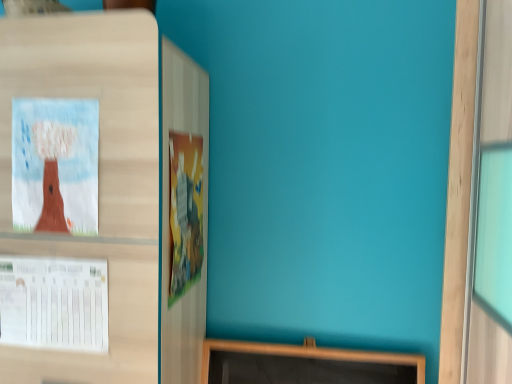
Question: Is cartoonish paper poster at center, which is the 1th poster in right-to-left order, oriented away from white paper at left, the 2th poster from the right?

Choices:
 (A) no
 (B) yes

Answer: (B)

Question: Is cartoonish paper poster at center, which is the 1th poster in right-to-left order, outside of white paper at left, the first poster from the left?

Choices:
 (A) yes
 (B) no

Answer: (A)

Question: Can you confirm if cartoonish paper poster at center, which ranks as the 2th poster in left-to-right order, is positioned to the left of white paper at left, the 2th poster from the right?

Choices:
 (A) no
 (B) yes

Answer: (A)

Question: From a real-world perspective, does cartoonish paper poster at center, which ranks as the 2th poster in left-to-right order, stand above white paper at left, the first poster from the left?

Choices:
 (A) yes
 (B) no

Answer: (A)

Question: Can you confirm if cartoonish paper poster at center, which ranks as the 2th poster in left-to-right order, is positioned to the right of white paper at left, the first poster from the left?

Choices:
 (A) yes
 (B) no

Answer: (A)

Question: From a real-world perspective, is cartoonish paper poster at center, which is the 1th poster in right-to-left order, positioned under white paper at left, the 2th poster from the right, based on gravity?

Choices:
 (A) no
 (B) yes

Answer: (A)

Question: Is white paper at left, the first poster from the left, not near cartoonish paper poster at center, which ranks as the 2th poster in left-to-right order?

Choices:
 (A) no
 (B) yes

Answer: (A)

Question: Does white paper at left, the first poster from the left, turn towards cartoonish paper poster at center, which ranks as the 2th poster in left-to-right order?

Choices:
 (A) yes
 (B) no

Answer: (B)

Question: Is white paper at left, the first poster from the left, looking in the opposite direction of cartoonish paper poster at center, which ranks as the 2th poster in left-to-right order?

Choices:
 (A) yes
 (B) no

Answer: (B)

Question: From a real-world perspective, is white paper at left, the 2th poster from the right, located beneath cartoonish paper poster at center, which ranks as the 2th poster in left-to-right order?

Choices:
 (A) no
 (B) yes

Answer: (B)

Question: Is white paper at left, the first poster from the left, to the left of cartoonish paper poster at center, which is the 1th poster in right-to-left order, from the viewer's perspective?

Choices:
 (A) yes
 (B) no

Answer: (A)

Question: Considering the relative sizes of white paper at left, the 2th poster from the right, and cartoonish paper poster at center, which is the 1th poster in right-to-left order, in the image provided, is white paper at left, the 2th poster from the right, thinner than cartoonish paper poster at center, which is the 1th poster in right-to-left order,?

Choices:
 (A) no
 (B) yes

Answer: (B)

Question: Choose the correct answer: Is white paper at left, the first poster from the left, inside cartoonish paper poster at center, which ranks as the 2th poster in left-to-right order, or outside it?

Choices:
 (A) outside
 (B) inside

Answer: (A)